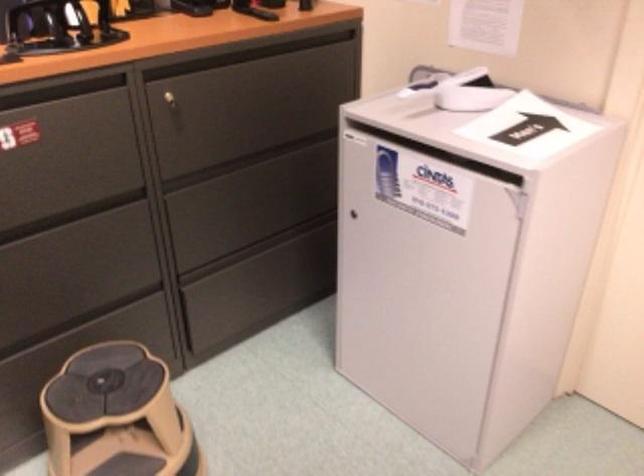
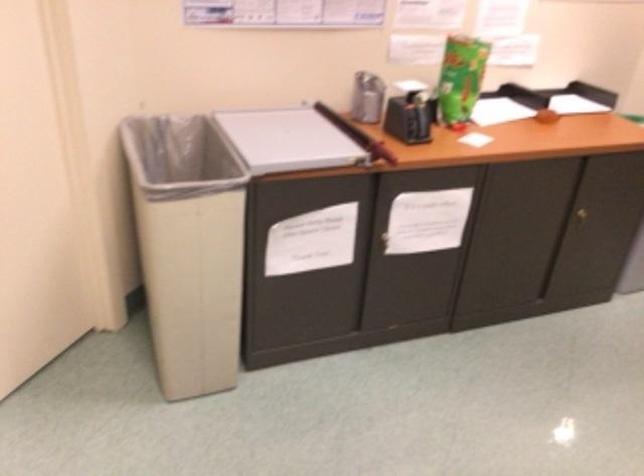
The images are taken continuously from a first-person perspective. In which direction is your viewpoint rotating?

The camera's rotation is toward right-down.